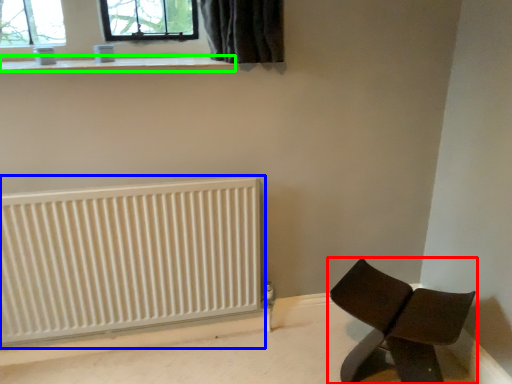
Question: Based on their relative distances, which object is farther from furniture (highlighted by a red box)? Choose from radiator (highlighted by a blue box) and window sill (highlighted by a green box).

Choices:
 (A) radiator
 (B) window sill

Answer: (B)